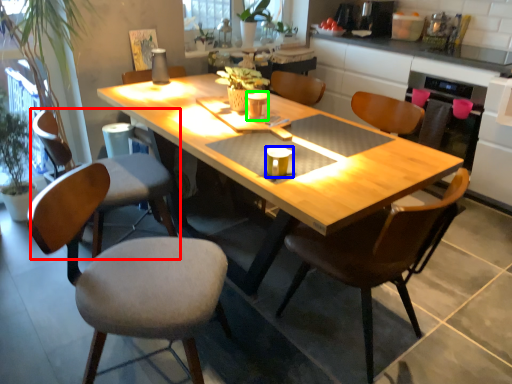
Question: Considering the real-world distances, which object is farthest from chair (highlighted by a red box)? coffee cup (highlighted by a blue box) or coffee cup (highlighted by a green box)?

Choices:
 (A) coffee cup
 (B) coffee cup

Answer: (A)